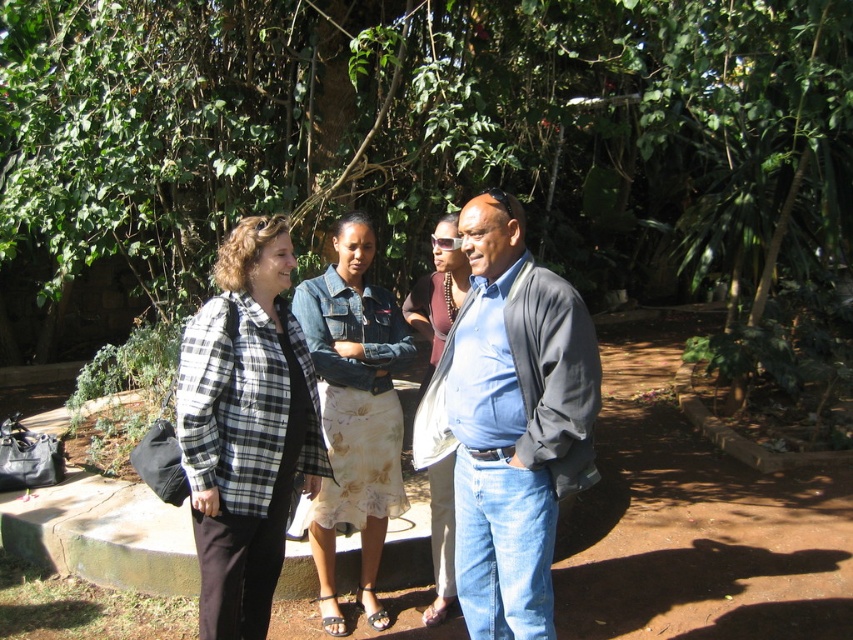
Based on the scene description, what are the coordinates of the green leafy tree at center?

The green leafy tree at center is located at coordinates point (428, 131).

You are a photographer trying to capture a group photo of the plaid shirt at left and the green leafy tree at center. The camera you are using has a maximum focusing range of 4 meters. Will you be able to frame both subjects within the same shot without moving either the camera or the subjects?

The green leafy tree at center and plaid shirt at left are 3.99 meters apart. Since the distance between them is just under 4 meters, the camera can focus on both subjects within the same shot without moving anything.

You are a photographer trying to capture the group in the scene. The green leafy tree at center and the plaid shirt at left are both in your viewfinder. Which object is positioned higher in the frame?

The green leafy tree at center is above the plaid shirt at left, so it is positioned higher in the frame.